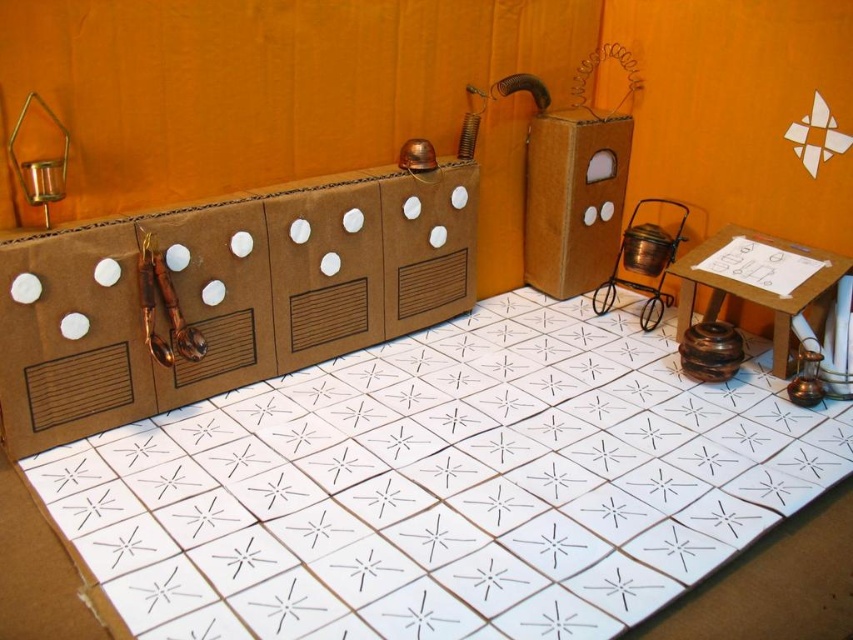
Question: Which is farther from the metallic candlestick at left?

Choices:
 (A) brown cardboard box at center
 (B) white cardboard floor at center

Answer: (B)

Question: Does white cardboard floor at center have a larger size compared to metallic candlestick at left?

Choices:
 (A) yes
 (B) no

Answer: (A)

Question: Based on their relative distances, which object is nearer to the white cardboard floor at center?

Choices:
 (A) brown cardboard box at center
 (B) metallic candlestick at left

Answer: (A)

Question: Is brown cardboard box at center to the right of metallic candlestick at left from the viewer's perspective?

Choices:
 (A) yes
 (B) no

Answer: (A)

Question: Does white cardboard floor at center have a smaller size compared to brown cardboard box at center?

Choices:
 (A) yes
 (B) no

Answer: (B)

Question: Which object appears farthest from the camera in this image?

Choices:
 (A) metallic candlestick at left
 (B) white cardboard floor at center

Answer: (A)